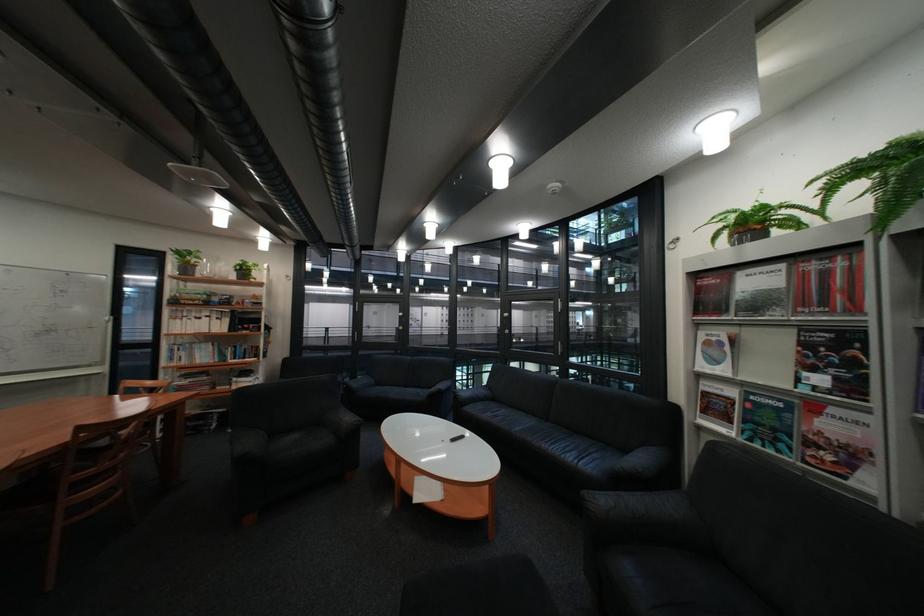
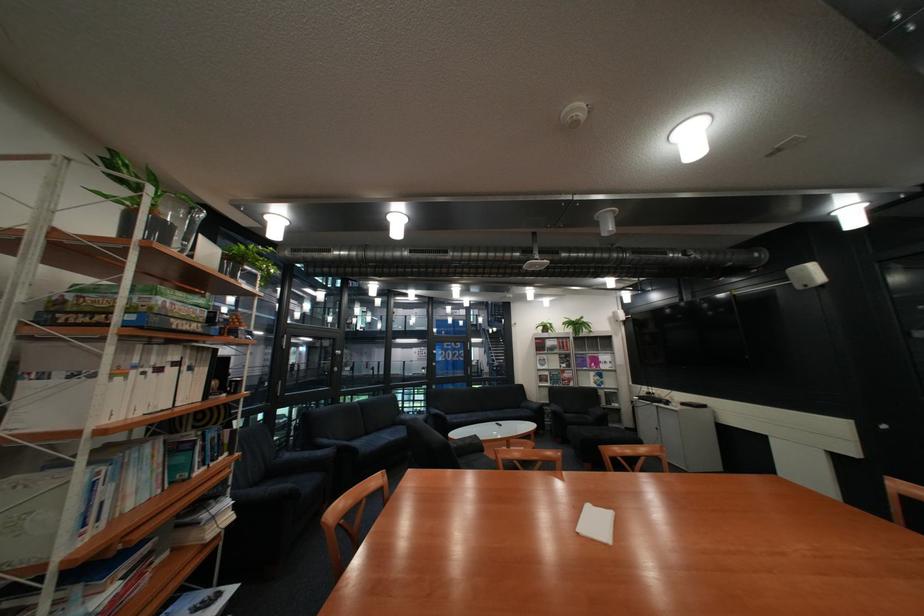
Locate, in the second image, the point that corresponds to point 219,345 in the first image.

(163, 448)